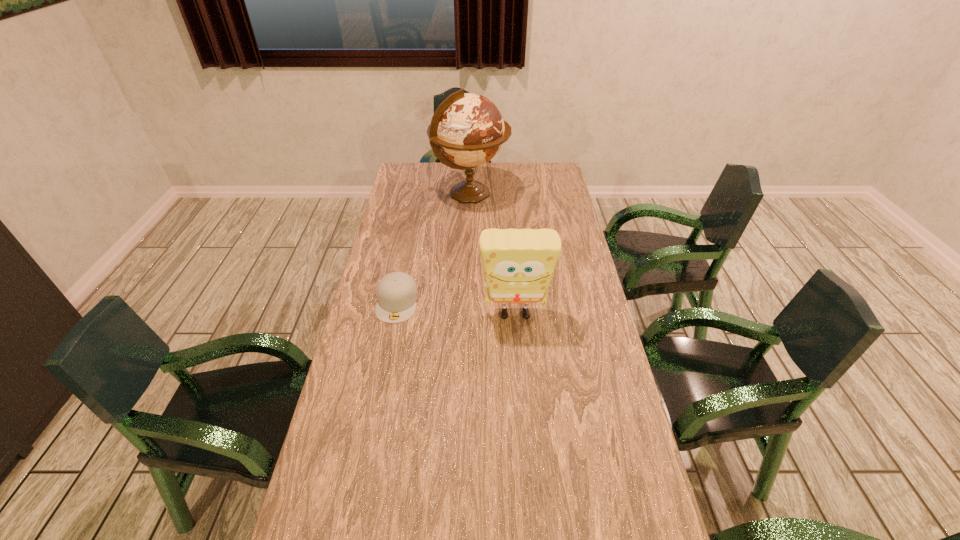
Find the location of a particular element. the farthest object is located at coordinates (467, 130).

At what (x,y) coordinates should I click in order to perform the action: click on globe. Please return your answer as a coordinate pair (x, y). This screenshot has width=960, height=540. Looking at the image, I should click on (467, 130).

The height and width of the screenshot is (540, 960). In order to click on the second tallest object in this screenshot , I will do `click(518, 264)`.

Image resolution: width=960 pixels, height=540 pixels. Identify the location of cap. (397, 294).

Identify the location of blank area located on the front of the farthest object showing Asia. (532, 194).

Find the location of a particular element. This screenshot has width=960, height=540. vacant point located 0.090m on the face of the second shortest object is located at coordinates (518, 353).

This screenshot has width=960, height=540. Find the location of `vacant space situated on the front-facing side of the cap`. vacant space situated on the front-facing side of the cap is located at coordinates (384, 367).

This screenshot has width=960, height=540. What are the coordinates of `object that is at the far edge` in the screenshot? It's located at (467, 130).

Locate an element on the screen. The width and height of the screenshot is (960, 540). object that is at the left edge is located at coordinates (397, 294).

This screenshot has width=960, height=540. I want to click on object that is at the right edge, so click(518, 264).